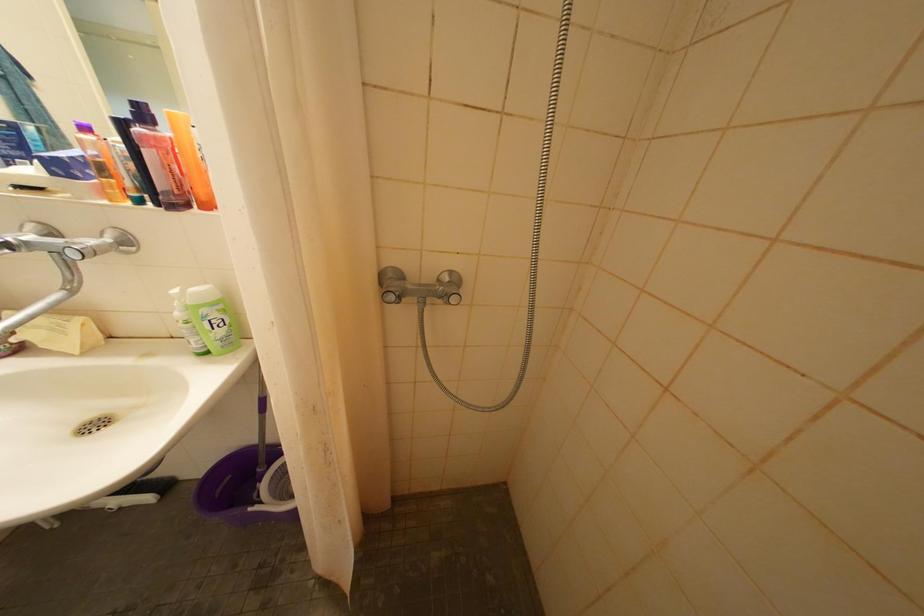
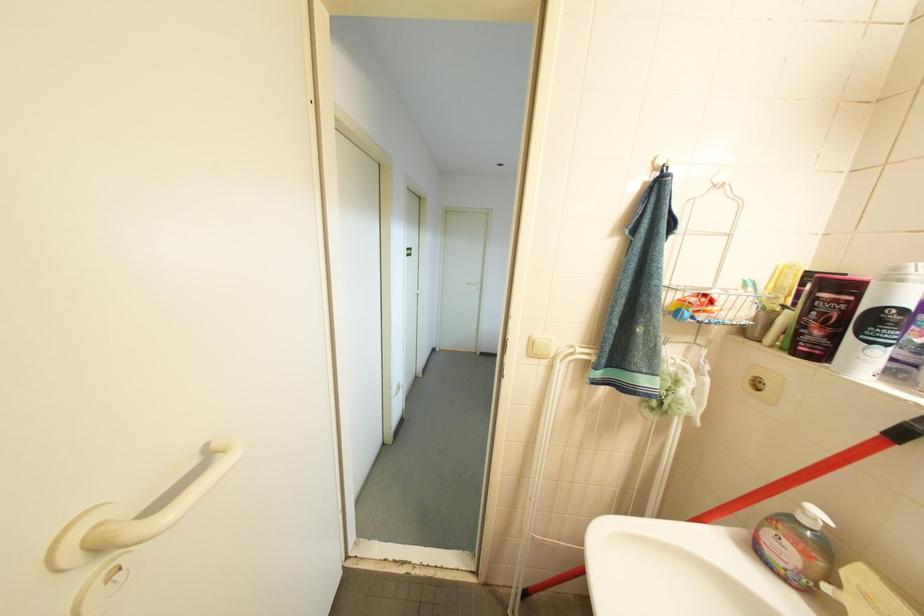
Question: The camera is either moving clockwise (left) or counter-clockwise (right) around the object. The first image is from the beginning of the video and the second image is from the end. Is the camera moving left or right when shooting the video?

Choices:
 (A) Left
 (B) Right

Answer: (B)